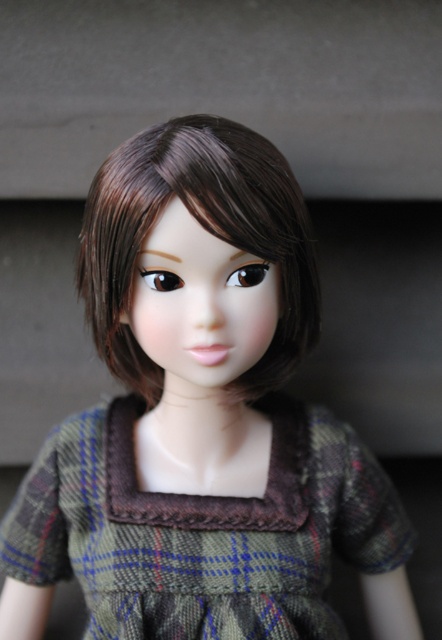
Looking at the doll in the image, which object is bigger between the plaid fabric dress at center and the brown silky hair at center?

The plaid fabric dress at center is larger than the brown silky hair at center.

The doll has a plaid fabric dress at center and brown silky hair at center. Which one is shorter?

The plaid fabric dress at center is shorter than the brown silky hair at center.